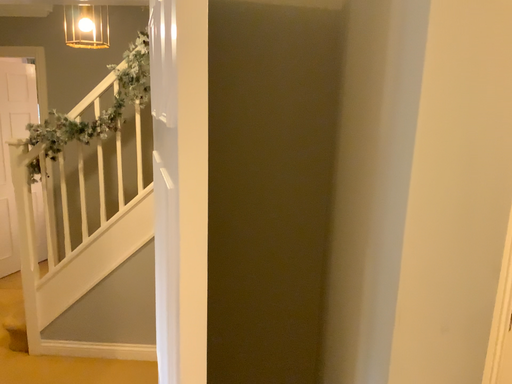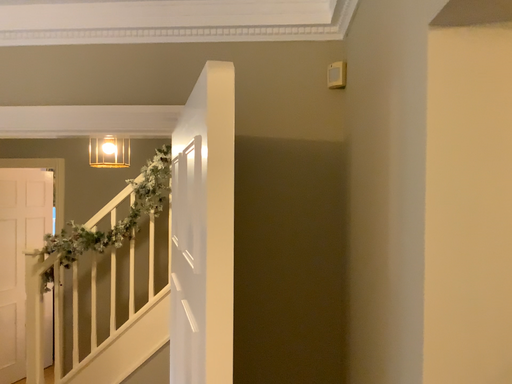
Question: How did the camera likely rotate when shooting the video?

Choices:
 (A) rotated downward
 (B) rotated upward

Answer: (B)